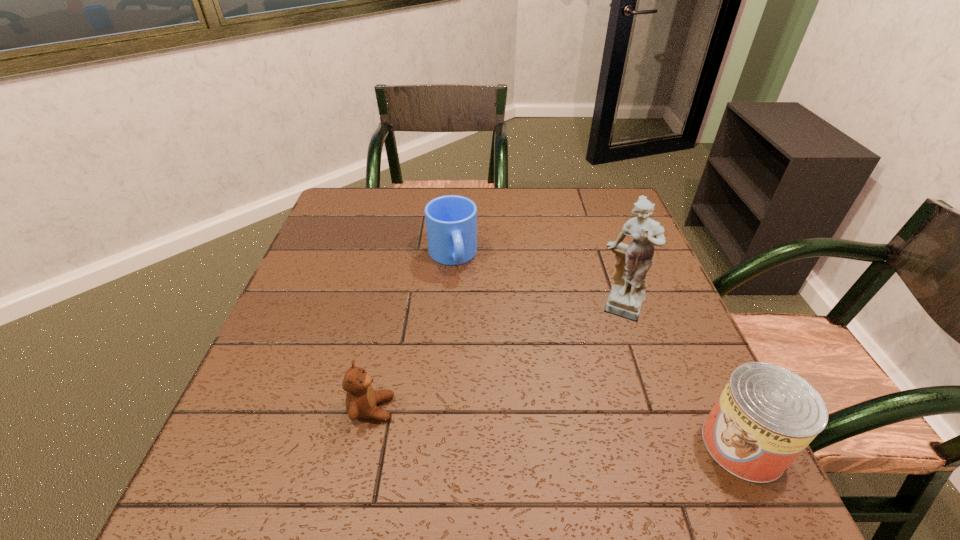
At what (x,y) coordinates should I click in order to perform the action: click on teddy bear. Please return your answer as a coordinate pair (x, y). The image size is (960, 540). Looking at the image, I should click on (361, 399).

The width and height of the screenshot is (960, 540). In order to click on the rightmost object in this screenshot , I will do `click(766, 415)`.

Locate an element on the screen. The height and width of the screenshot is (540, 960). the third object from left to right is located at coordinates (633, 261).

Identify the location of figurine. Image resolution: width=960 pixels, height=540 pixels. (633, 261).

Where is `the farthest object`? the farthest object is located at coordinates (451, 221).

The height and width of the screenshot is (540, 960). I want to click on mug, so click(451, 221).

Where is `free space located at the face of the leftmost object`? The image size is (960, 540). free space located at the face of the leftmost object is located at coordinates (553, 409).

Find the location of a particular element. The height and width of the screenshot is (540, 960). vacant region located on the back of the rightmost object is located at coordinates tap(667, 286).

Find the location of a particular element. The height and width of the screenshot is (540, 960). vacant space situated on the front-facing side of the third object from left to right is located at coordinates (604, 410).

This screenshot has height=540, width=960. I want to click on vacant region located on the front-facing side of the third object from left to right, so point(616,348).